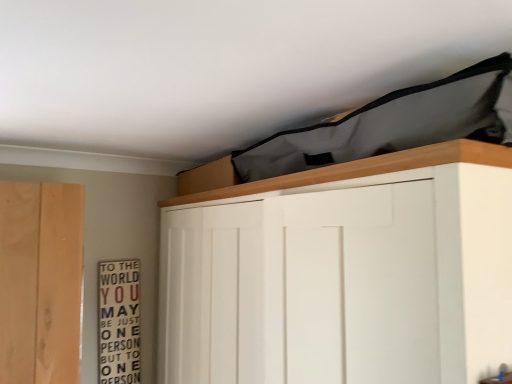
Question: From a real-world perspective, does white matte cupboard at upper center stand above wooden signboard at left?

Choices:
 (A) no
 (B) yes

Answer: (B)

Question: Does white matte cupboard at upper center appear on the right side of wooden signboard at left?

Choices:
 (A) no
 (B) yes

Answer: (B)

Question: From the image's perspective, is white matte cupboard at upper center located beneath wooden signboard at left?

Choices:
 (A) yes
 (B) no

Answer: (B)

Question: Does white matte cupboard at upper center have a lesser height compared to wooden signboard at left?

Choices:
 (A) yes
 (B) no

Answer: (B)

Question: Considering the relative sizes of white matte cupboard at upper center and wooden signboard at left in the image provided, is white matte cupboard at upper center wider than wooden signboard at left?

Choices:
 (A) yes
 (B) no

Answer: (A)

Question: Can you confirm if white matte cupboard at upper center is taller than wooden signboard at left?

Choices:
 (A) no
 (B) yes

Answer: (B)

Question: Is wooden signboard at left next to white matte cupboard at upper center and touching it?

Choices:
 (A) yes
 (B) no

Answer: (B)

Question: Is wooden signboard at left further to the viewer compared to white matte cupboard at upper center?

Choices:
 (A) no
 (B) yes

Answer: (B)

Question: Is wooden signboard at left not near white matte cupboard at upper center?

Choices:
 (A) yes
 (B) no

Answer: (B)

Question: Is wooden signboard at left closer to camera compared to white matte cupboard at upper center?

Choices:
 (A) yes
 (B) no

Answer: (B)

Question: Can you confirm if wooden signboard at left is bigger than white matte cupboard at upper center?

Choices:
 (A) no
 (B) yes

Answer: (A)

Question: Can you confirm if wooden signboard at left is shorter than white matte cupboard at upper center?

Choices:
 (A) no
 (B) yes

Answer: (B)

Question: Considering the positions of wooden signboard at left and white matte cupboard at upper center in the image, is wooden signboard at left wider or thinner than white matte cupboard at upper center?

Choices:
 (A) thin
 (B) wide

Answer: (A)